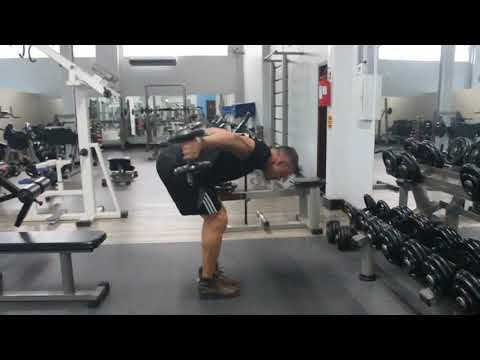
Locate an element on the screen. This screenshot has height=360, width=480. window is located at coordinates (463, 51), (414, 53), (182, 50), (87, 52), (12, 53).